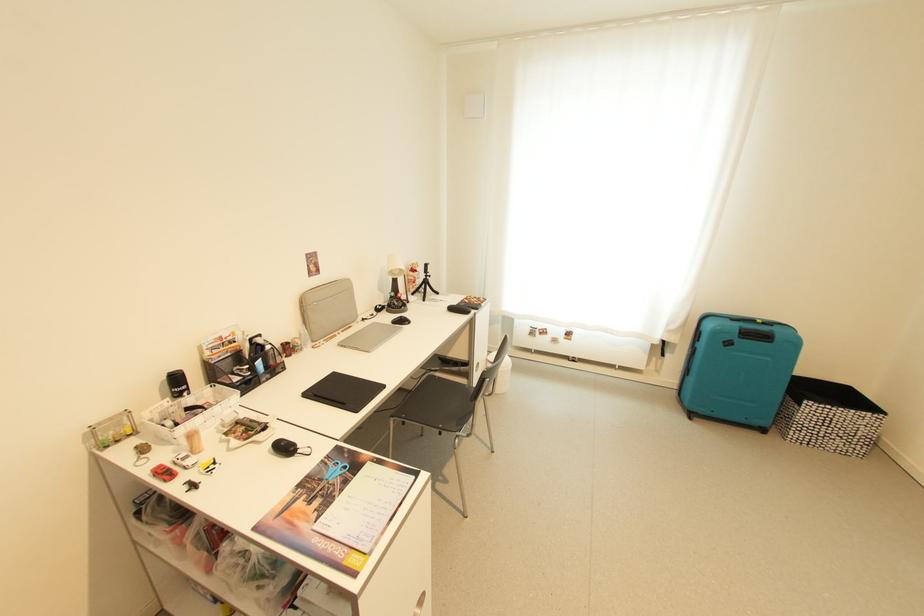
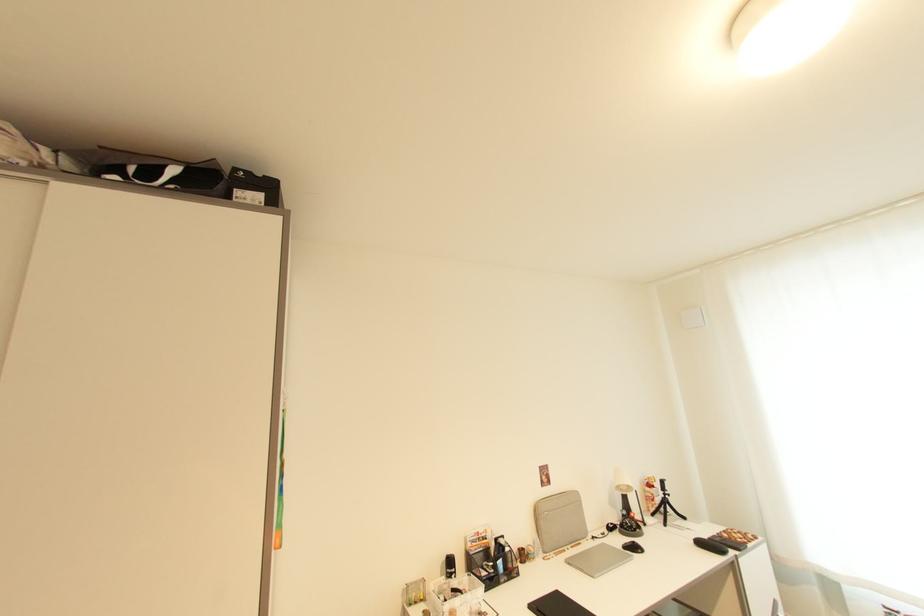
Where in the second image is the point corresponding to pixel 407 323 from the first image?

(639, 549)